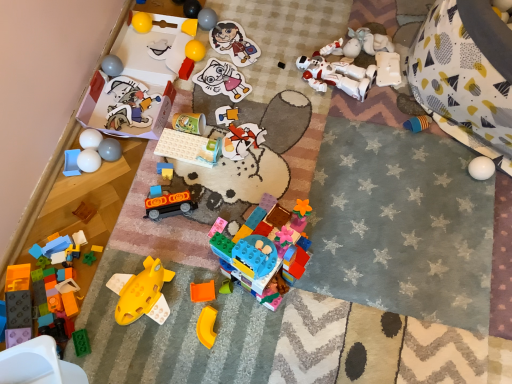
I want to click on vacant area on the back side of black plastic train at center, which is counted as the tenth toy, starting from the left, so click(x=175, y=172).